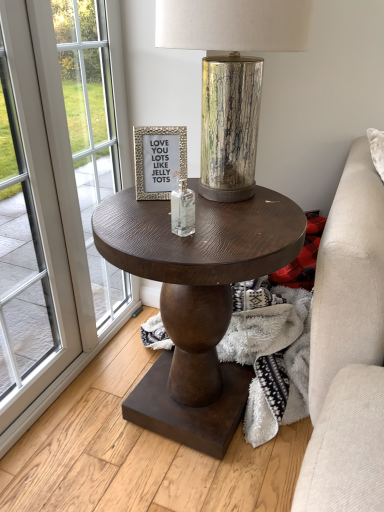
I want to click on vacant space in front of silver textured frame at center, so click(x=153, y=217).